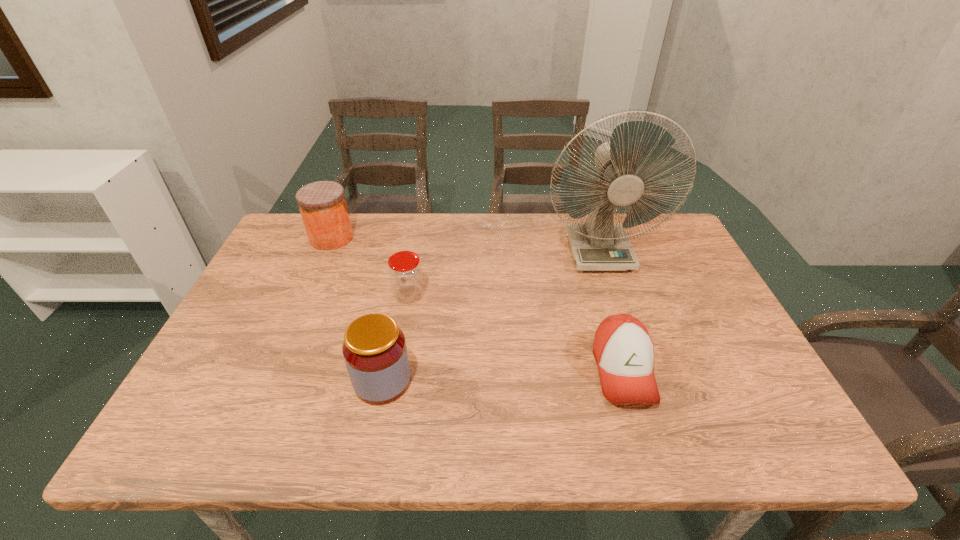
Locate an element on the screen. free point between the third nearest object and the baseball cap is located at coordinates (516, 333).

Locate an element on the screen. This screenshot has width=960, height=540. free space between the second farthest jar and the tallest object is located at coordinates (504, 273).

Choose which object is the fourth nearest neighbor to the second nearest jar. Please provide its 2D coordinates. Your answer should be formatted as a tuple, i.e. [(x, y)], where the tuple contains the x and y coordinates of a point satisfying the conditions above.

[(624, 351)]

Find the location of a particular element. This screenshot has width=960, height=540. object that can be found as the closest to the fan is located at coordinates (624, 351).

Where is `the second closest jar to the leftmost jar`? The width and height of the screenshot is (960, 540). the second closest jar to the leftmost jar is located at coordinates (374, 349).

Where is `the second closest jar relative to the fan`? The width and height of the screenshot is (960, 540). the second closest jar relative to the fan is located at coordinates (374, 349).

The width and height of the screenshot is (960, 540). I want to click on vacant area that satisfies the following two spatial constraints: 1. on the front side of the third nearest object; 2. on the right side of the leftmost jar, so click(x=307, y=295).